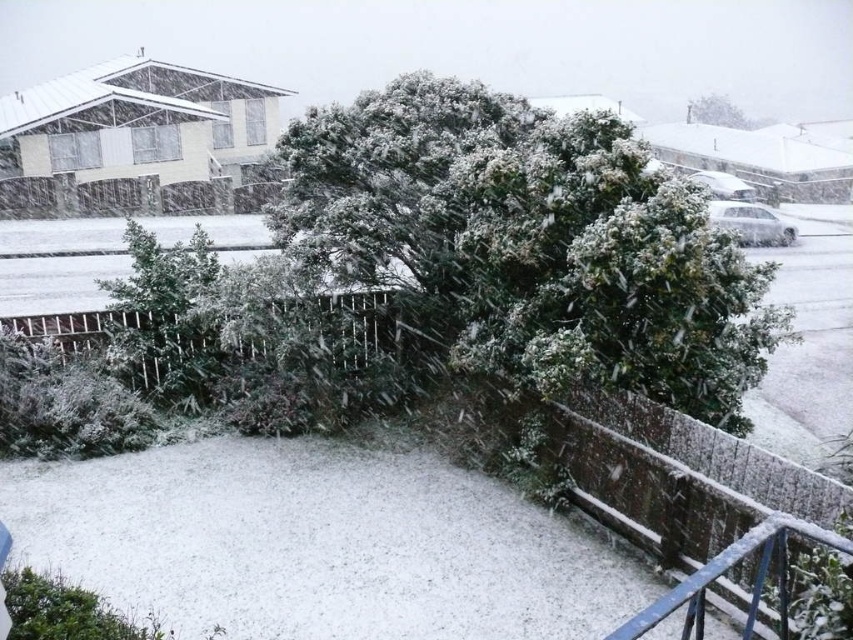
You are standing at the point marked by the coordinates point [532,243] in the snowy scene. What object are you standing on?

You are standing on the green matte bush at center, as the coordinates point [532,243] represent this object.

You are a delivery drone that needs to fly from the green matte bush at center to the green leafy bush at upper center. Given that your maximum flight range is 150 feet, will you be able to reach the destination without recharging?

The green matte bush at center is 163.73 feet from the green leafy bush at upper center. Since the distance exceeds the drone s 150 feet range, the drone cannot reach the destination without recharging.

You are standing at the origin point of the image coordinate system. You want to walk towards the green matte bush at center. In which direction should you move relative to the coordinate system?

You should move towards the point with coordinates 0.380 in the x direction and 0.625 in the y direction to reach the green matte bush at center.